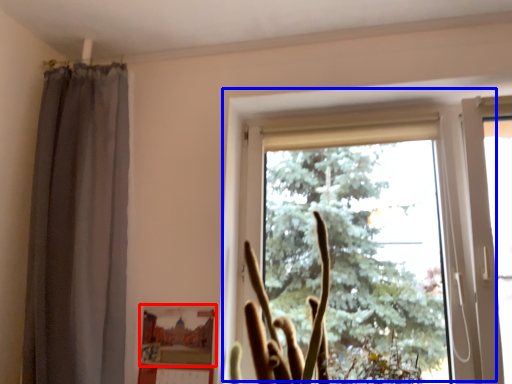
Question: Which object appears closest to the camera in this image, picture frame (highlighted by a red box) or window (highlighted by a blue box)?

Choices:
 (A) picture frame
 (B) window

Answer: (B)